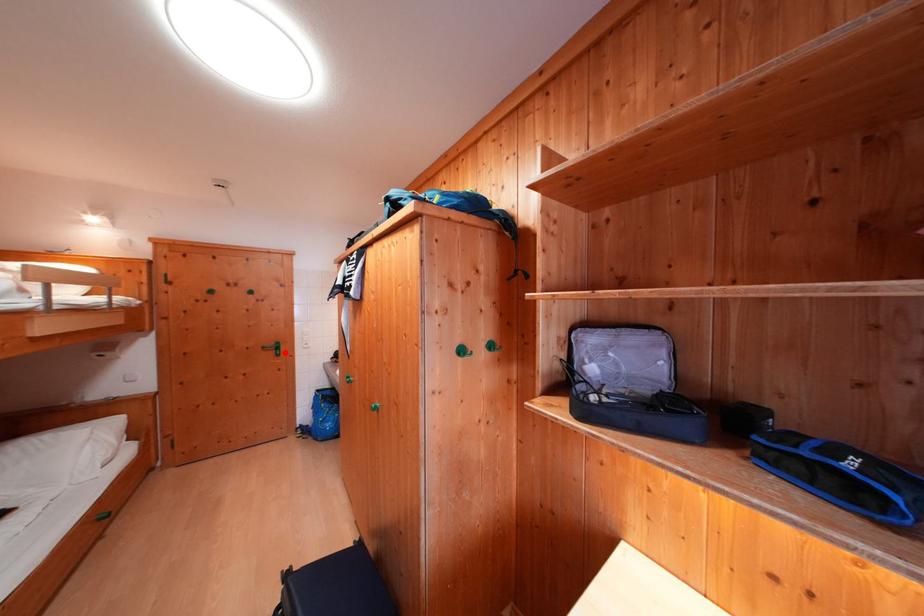
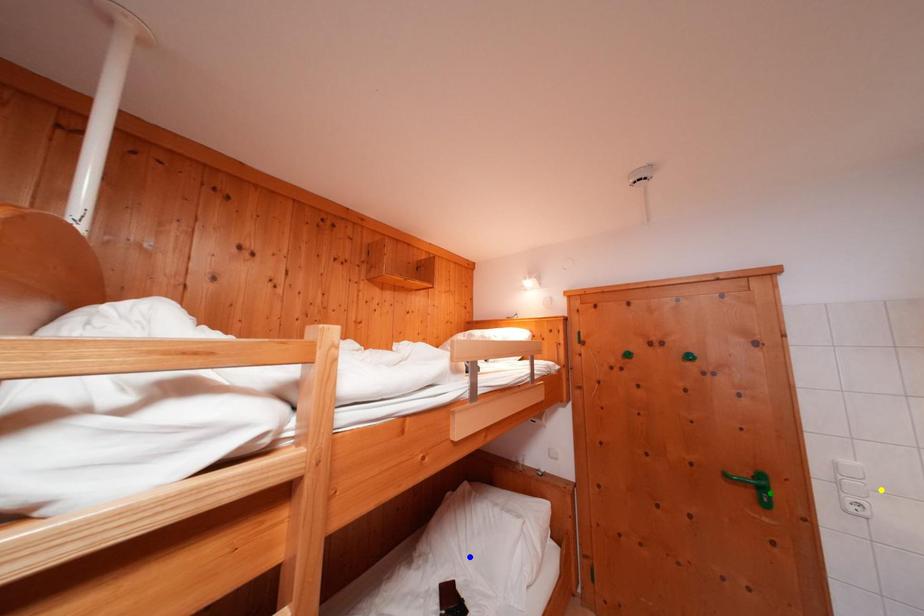
Question: I am providing you with two images of the same scene from different viewpoints. A red point is marked on the first image. You are given multiple points on the second image. Can you choose the point in image 2 that corresponds to the point in image 1?

Choices:
 (A) green point
 (B) blue point
 (C) yellow point

Answer: (A)